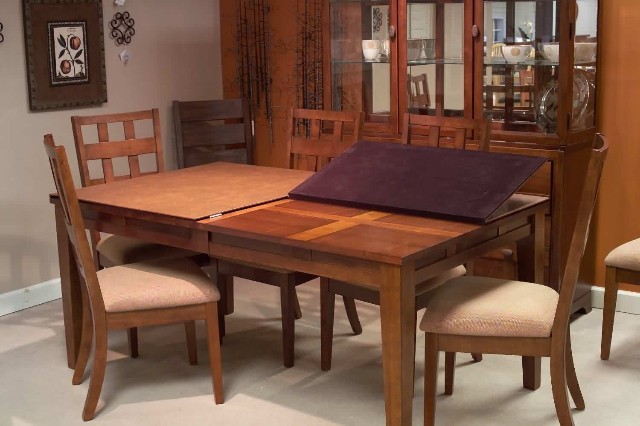
You are a GUI agent. You are given a task and a screenshot of the screen. Output one action in this format:
    pyautogui.click(x=<x>, y=<y>)
    Task: Click on the back wall
    
    Given the screenshot: What is the action you would take?
    pyautogui.click(x=176, y=77), pyautogui.click(x=604, y=109)